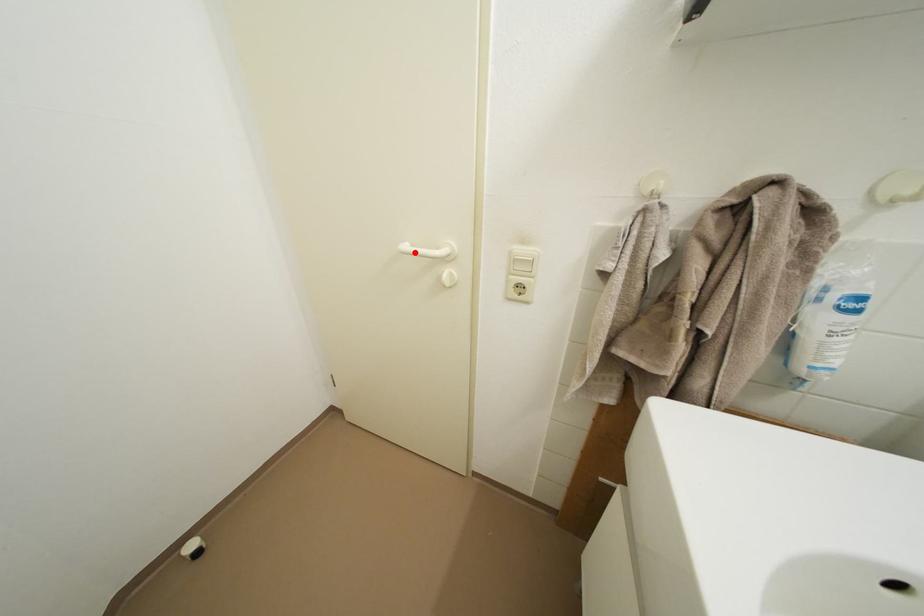
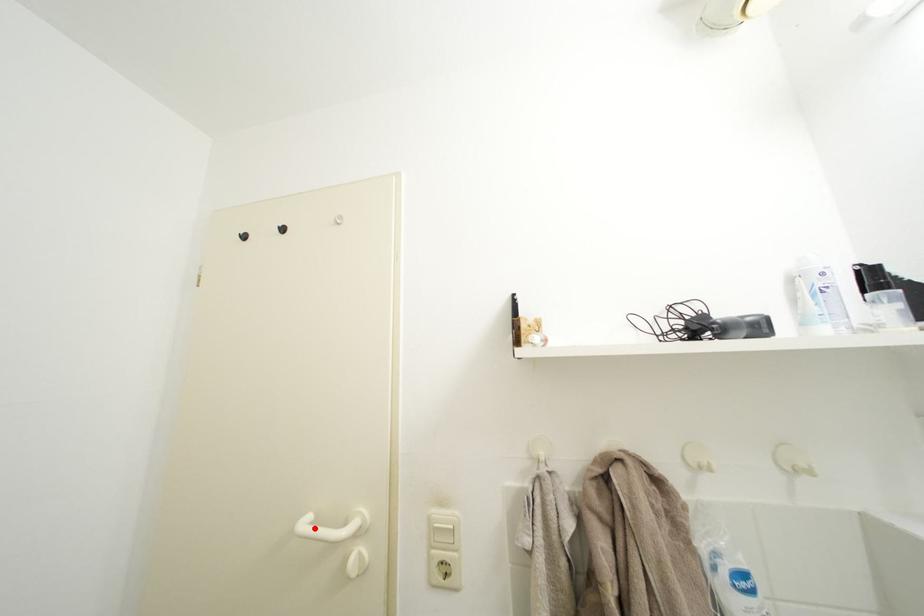
I am providing you with two images of the same scene from different viewpoints. A red point is marked on the first image and another point is marked on the second image. Does the point marked in image1 correspond to the same location as the one in image2?

Yes